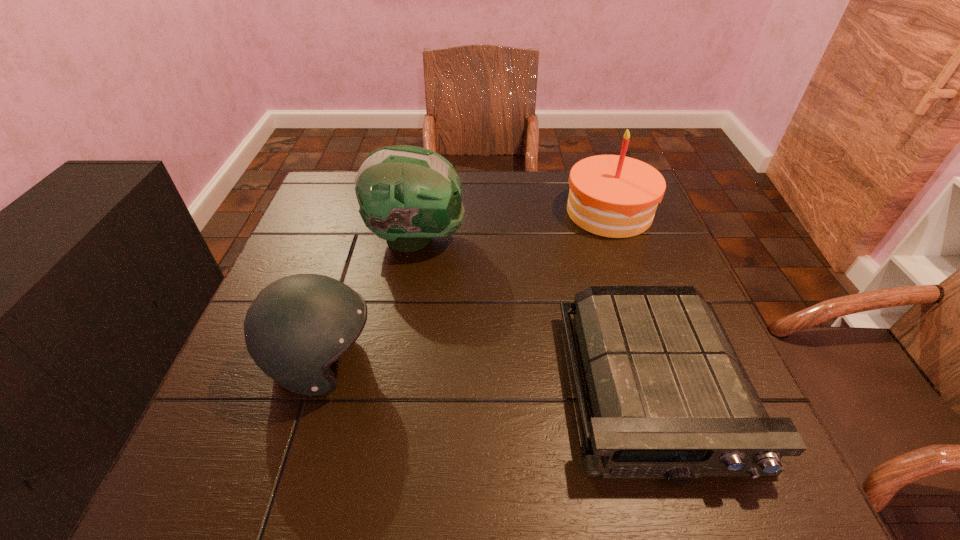
Locate an element on the screen. The image size is (960, 540). object present at the near edge is located at coordinates (670, 398).

Find the location of `object situated at the left edge`. object situated at the left edge is located at coordinates (297, 326).

I want to click on birthday cake that is positioned at the right edge, so click(615, 196).

This screenshot has width=960, height=540. I want to click on radio receiver positioned at the right edge, so click(670, 398).

Identify the location of object that is at the far right corner. This screenshot has width=960, height=540. (615, 196).

Image resolution: width=960 pixels, height=540 pixels. I want to click on object at the near right corner, so click(x=670, y=398).

At what (x,y) coordinates should I click in order to perform the action: click on vacant space at the far edge. Please return your answer as a coordinate pair (x, y). The height and width of the screenshot is (540, 960). Looking at the image, I should click on (562, 210).

This screenshot has width=960, height=540. Identify the location of vacant space at the near edge of the desktop. (487, 443).

Where is `free space at the left edge`? free space at the left edge is located at coordinates (310, 273).

In the image, there is a desktop. Identify the location of vacant space at the right edge. The image size is (960, 540). (655, 221).